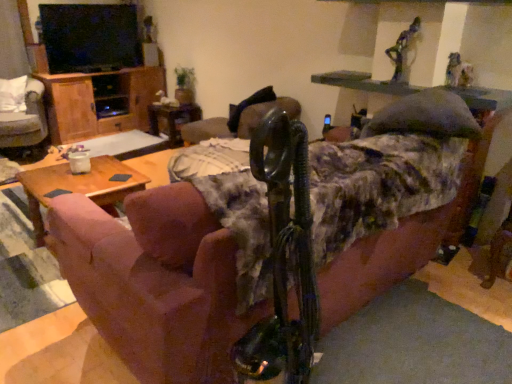
Question: From the image's perspective, is wooden cabinet at left on white fabric chair at left, positioned as the second chair in right-to-left order?

Choices:
 (A) no
 (B) yes

Answer: (B)

Question: From a real-world perspective, is wooden cabinet at left physically below white fabric chair at left, the first chair viewed from the left?

Choices:
 (A) no
 (B) yes

Answer: (A)

Question: From a real-world perspective, does wooden cabinet at left stand above white fabric chair at left, positioned as the second chair in right-to-left order?

Choices:
 (A) yes
 (B) no

Answer: (A)

Question: Is wooden cabinet at left aimed at white fabric chair at left, positioned as the second chair in right-to-left order?

Choices:
 (A) yes
 (B) no

Answer: (A)

Question: Is wooden cabinet at left shorter than white fabric chair at left, positioned as the second chair in right-to-left order?

Choices:
 (A) yes
 (B) no

Answer: (B)

Question: In the image, is white fabric chair at left, the first chair viewed from the left, positioned in front of or behind metallic statue at center, which is the 1th chair from right to left?

Choices:
 (A) behind
 (B) front

Answer: (A)

Question: In terms of height, does white fabric chair at left, positioned as the second chair in right-to-left order, look taller or shorter compared to metallic statue at center, which is the 1th chair from right to left?

Choices:
 (A) tall
 (B) short

Answer: (A)

Question: From a real-world perspective, is white fabric chair at left, the first chair viewed from the left, positioned above or below metallic statue at center, which is the 1th chair from right to left?

Choices:
 (A) below
 (B) above

Answer: (A)

Question: Considering the positions of point (13, 152) and point (245, 135), is point (13, 152) closer or farther from the camera than point (245, 135)?

Choices:
 (A) closer
 (B) farther

Answer: (B)

Question: In the image, is pink fabric couch at center on the left side or the right side of wooden side table at center?

Choices:
 (A) right
 (B) left

Answer: (A)

Question: Is pink fabric couch at center bigger or smaller than wooden side table at center?

Choices:
 (A) small
 (B) big

Answer: (B)

Question: From a real-world perspective, is pink fabric couch at center physically located above or below wooden side table at center?

Choices:
 (A) above
 (B) below

Answer: (A)

Question: Considering the positions of pink fabric couch at center and wooden side table at center in the image, is pink fabric couch at center taller or shorter than wooden side table at center?

Choices:
 (A) tall
 (B) short

Answer: (A)

Question: Considering the positions of metallic statue at center, which is the 1th chair from right to left, and pink fabric couch at center in the image, is metallic statue at center, which is the 1th chair from right to left, bigger or smaller than pink fabric couch at center?

Choices:
 (A) small
 (B) big

Answer: (A)

Question: Is metallic statue at center, which is the 1th chair from right to left, situated inside pink fabric couch at center or outside?

Choices:
 (A) outside
 (B) inside

Answer: (A)